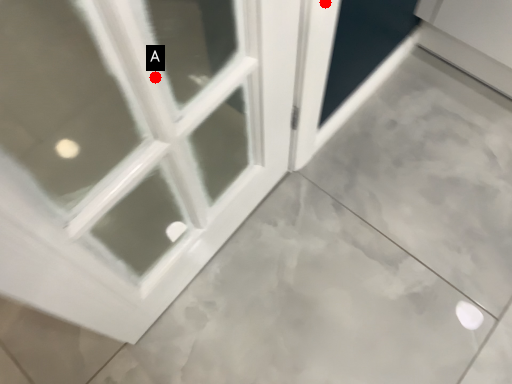
Question: Two points are circled on the image, labeled by A and B beside each circle. Which point appears closest to the camera in this image?

Choices:
 (A) A is closer
 (B) B is closer

Answer: (A)